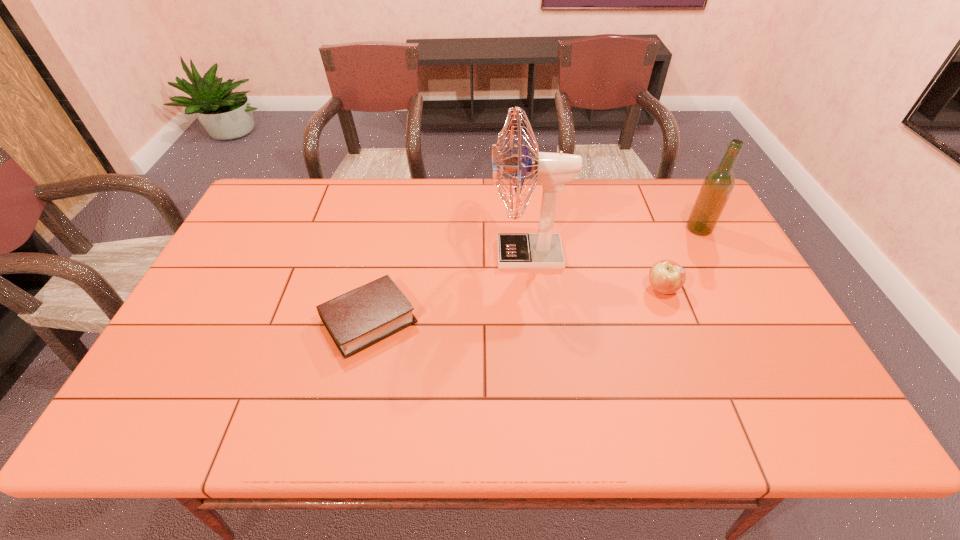
Identify the location of vacant space at the right edge of the desktop. This screenshot has height=540, width=960. (756, 343).

At what (x,y) coordinates should I click in order to perform the action: click on vacant space at the far left corner of the desktop. Please return your answer as a coordinate pair (x, y). Looking at the image, I should click on (274, 207).

Identify the location of vacant region at the far right corner. The width and height of the screenshot is (960, 540). (685, 209).

Image resolution: width=960 pixels, height=540 pixels. I want to click on vacant region between the Bible and the third object from right to left, so click(x=448, y=287).

Find the location of a particular element. Image resolution: width=960 pixels, height=540 pixels. free area in between the third shortest object and the Bible is located at coordinates (534, 274).

Identify the location of free spot between the rightmost object and the leftmost object. (534, 274).

Image resolution: width=960 pixels, height=540 pixels. Identify the location of free space between the second object from left to right and the third shortest object. (613, 241).

The image size is (960, 540). In order to click on unoccupied position between the apple and the Bible in this screenshot , I will do `click(516, 305)`.

This screenshot has width=960, height=540. I want to click on unoccupied area between the liquor and the second object from left to right, so click(x=613, y=241).

Find the location of a particular element. This screenshot has height=540, width=960. vacant point located between the third object from left to right and the second tallest object is located at coordinates (681, 259).